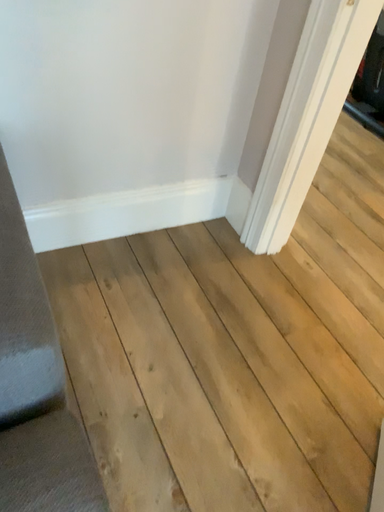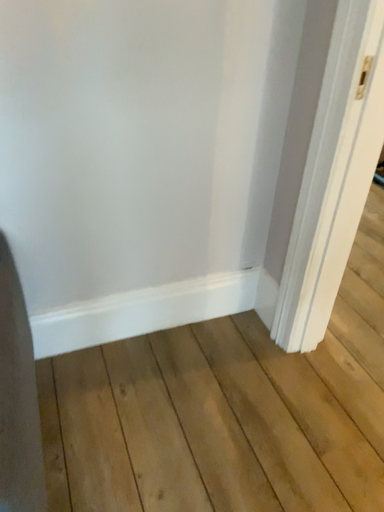
Question: Which way did the camera rotate in the video?

Choices:
 (A) rotated downward
 (B) rotated upward

Answer: (B)